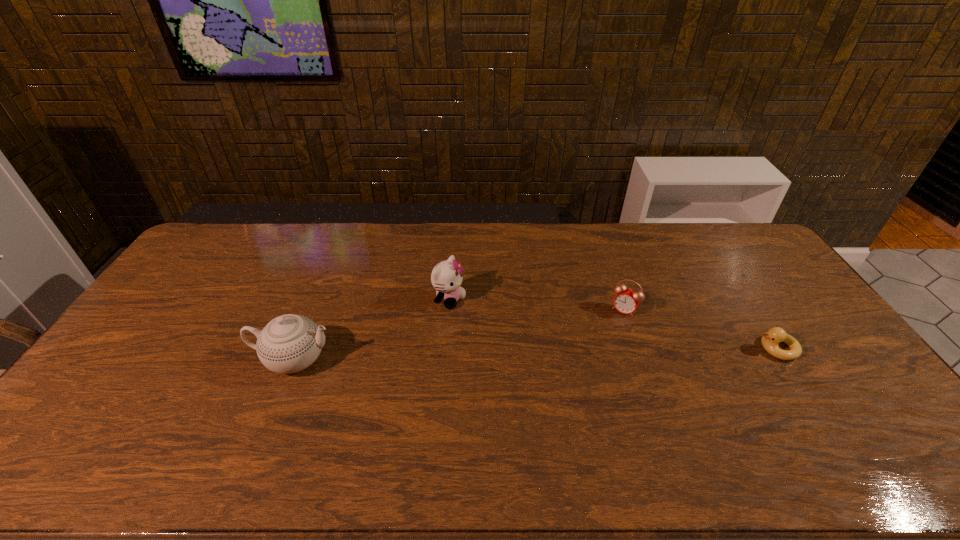
Identify the location of vacant spot on the desktop that is between the leftmost object and the shortest object and is positioned on the front-facing side of the third object from right to left. The width and height of the screenshot is (960, 540). (567, 353).

Find the location of a particular element. The width and height of the screenshot is (960, 540). free space on the desktop that is between the chinaware and the shortest object and is positioned on the clock face of the second shortest object is located at coordinates (597, 352).